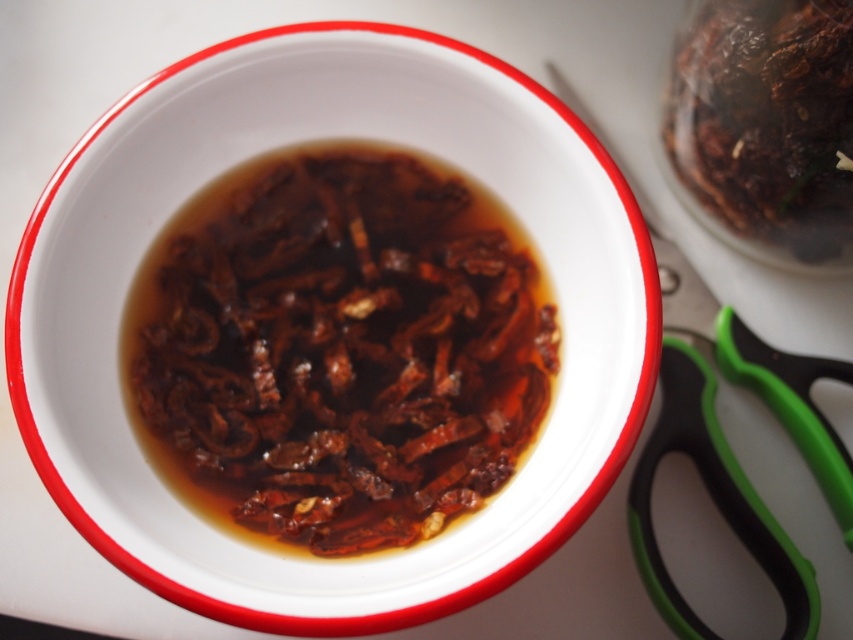
Between point (740, 32) and point (717, 518), which one is positioned in front?

Point (740, 32) is more forward.

Is point (808, 182) closer to camera compared to point (675, 301)?

That is True.

Where is `brown glossy dried chilies at upper right`? The width and height of the screenshot is (853, 640). brown glossy dried chilies at upper right is located at coordinates (764, 125).

Who is more distant from viewer, (x=410, y=317) or (x=792, y=515)?

Positioned behind is point (x=792, y=515).

Is brown glossy dried chilies at center to the left of green plastic scissors at lower right from the viewer's perspective?

Correct, you'll find brown glossy dried chilies at center to the left of green plastic scissors at lower right.

Is point (450, 413) positioned behind point (726, 598)?

No.

Find the location of `brown glossy dried chilies at center`. brown glossy dried chilies at center is located at coordinates (339, 348).

Does point (151, 339) come farther from viewer compared to point (730, 76)?

No.

Is point (294, 353) closer to viewer compared to point (755, 8)?

No, it is behind (755, 8).

Image resolution: width=853 pixels, height=640 pixels. In order to click on brown glossy dried chilies at center in this screenshot , I will do `click(339, 348)`.